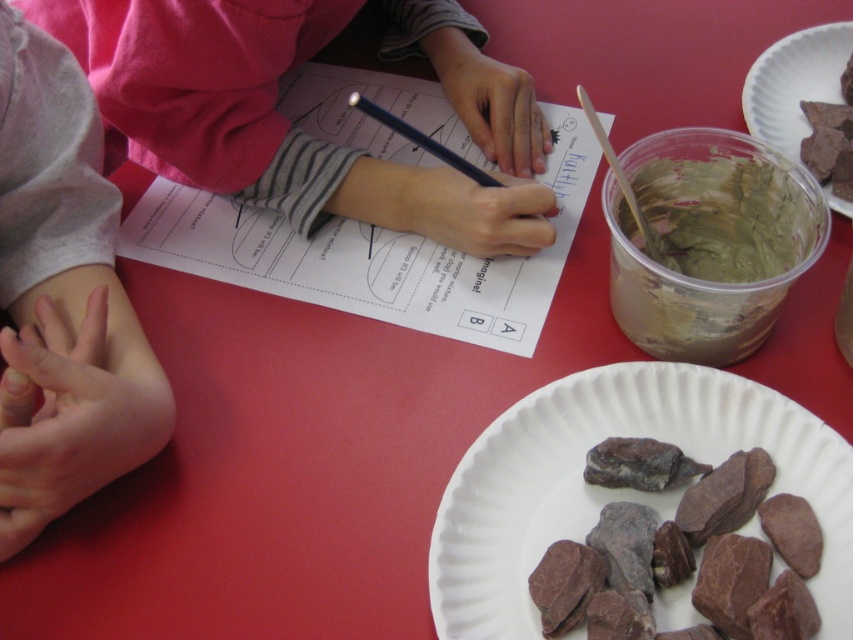
Question: Is matte pink shirt at upper left smaller than green clay paste at upper right?

Choices:
 (A) no
 (B) yes

Answer: (A)

Question: Which of the following is the closest to the observer?

Choices:
 (A) matte pink shirt at upper left
 (B) chocolate cake at upper right

Answer: (A)

Question: Can you confirm if matte pink shirt at upper left is wider than brown matte paper plate at upper right?

Choices:
 (A) yes
 (B) no

Answer: (A)

Question: Which object is closer to the camera taking this photo?

Choices:
 (A) chocolate cake at upper right
 (B) green clay paste at upper right
 (C) brown matte paper plate at upper right
 (D) smooth brown stones at center

Answer: (D)

Question: Which object appears closest to the camera in this image?

Choices:
 (A) brown matte paper plate at upper right
 (B) matte pink shirt at upper left
 (C) smooth brown stones at center

Answer: (C)

Question: Is matte pink shirt at upper left smaller than chocolate cake at upper right?

Choices:
 (A) yes
 (B) no

Answer: (B)